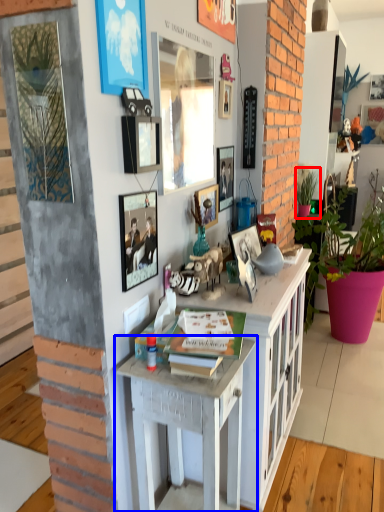
Question: Which of the following is the closest to the observer, houseplant (highlighted by a red box) or desk (highlighted by a blue box)?

Choices:
 (A) houseplant
 (B) desk

Answer: (B)